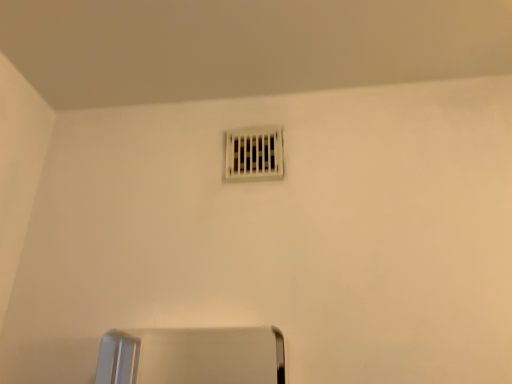
The image size is (512, 384). What do you see at coordinates (254, 154) in the screenshot? I see `white plastic vent at upper center` at bounding box center [254, 154].

At what (x,y) coordinates should I click in order to perform the action: click on white plastic vent at upper center. Please return your answer as a coordinate pair (x, y). Looking at the image, I should click on pyautogui.click(x=254, y=154).

Image resolution: width=512 pixels, height=384 pixels. I want to click on white plastic vent at upper center, so click(x=254, y=154).